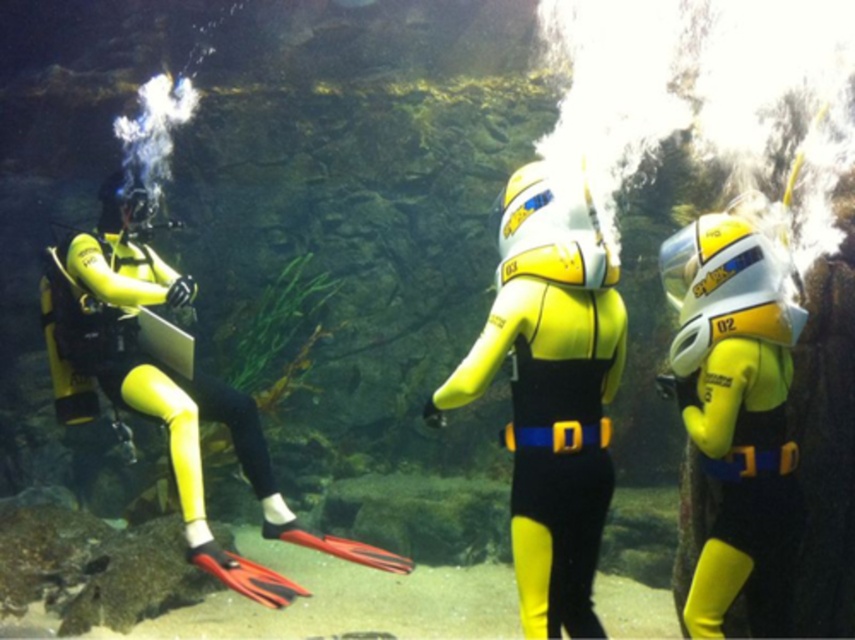
Does point (516, 228) lie behind point (46, 291)?

That is False.

Can you confirm if yellow matte wetsuit at center is positioned to the right of yellow matte wetsuit at left?

Correct, you'll find yellow matte wetsuit at center to the right of yellow matte wetsuit at left.

Between point (541, 364) and point (198, 528), which one is positioned behind?

Point (198, 528)

Image resolution: width=855 pixels, height=640 pixels. I want to click on yellow matte wetsuit at center, so click(x=550, y=392).

Can you confirm if yellow matte scuba suit at right is positioned above yellow matte wetsuit at left?

Correct, yellow matte scuba suit at right is located above yellow matte wetsuit at left.

Does point (712, 252) come closer to viewer compared to point (116, 349)?

Yes, it is.

Does point (718, 307) come behind point (171, 461)?

No.

Find the location of a particular element. This screenshot has height=640, width=855. yellow matte scuba suit at right is located at coordinates (736, 412).

Is yellow matte wetsuit at center in front of yellow matte scuba suit at right?

That is True.

Which is above, yellow matte wetsuit at center or yellow matte scuba suit at right?

yellow matte wetsuit at center

Measure the distance between yellow matte wetsuit at center and camera.

The distance of yellow matte wetsuit at center from camera is 2.52 meters.

At what (x,y) coordinates should I click in order to perform the action: click on yellow matte wetsuit at center. Please return your answer as a coordinate pair (x, y). This screenshot has height=640, width=855. Looking at the image, I should click on (550, 392).